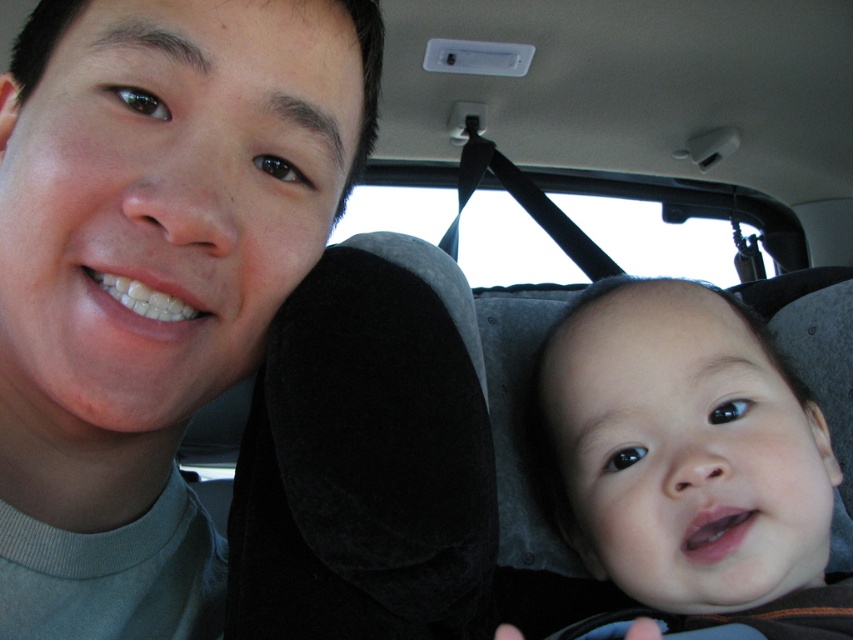
Question: Does matte gray headrest at left lie in front of smooth skin baby at right?

Choices:
 (A) no
 (B) yes

Answer: (A)

Question: Is matte gray headrest at left behind smooth skin baby at right?

Choices:
 (A) no
 (B) yes

Answer: (B)

Question: Which point is closer to the camera?

Choices:
 (A) smooth skin baby at right
 (B) matte gray headrest at left

Answer: (A)

Question: Is matte gray headrest at left below smooth skin baby at right?

Choices:
 (A) no
 (B) yes

Answer: (A)